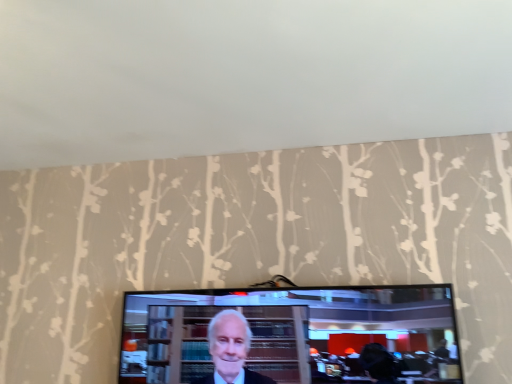
The height and width of the screenshot is (384, 512). What do you see at coordinates (285, 334) in the screenshot?
I see `black glossy tv at center` at bounding box center [285, 334].

This screenshot has height=384, width=512. In order to click on black glossy tv at center in this screenshot , I will do `click(285, 334)`.

What is the approximate height of black glossy tv at center?

12.72 inches.

The image size is (512, 384). In order to click on black glossy tv at center in this screenshot , I will do `click(285, 334)`.